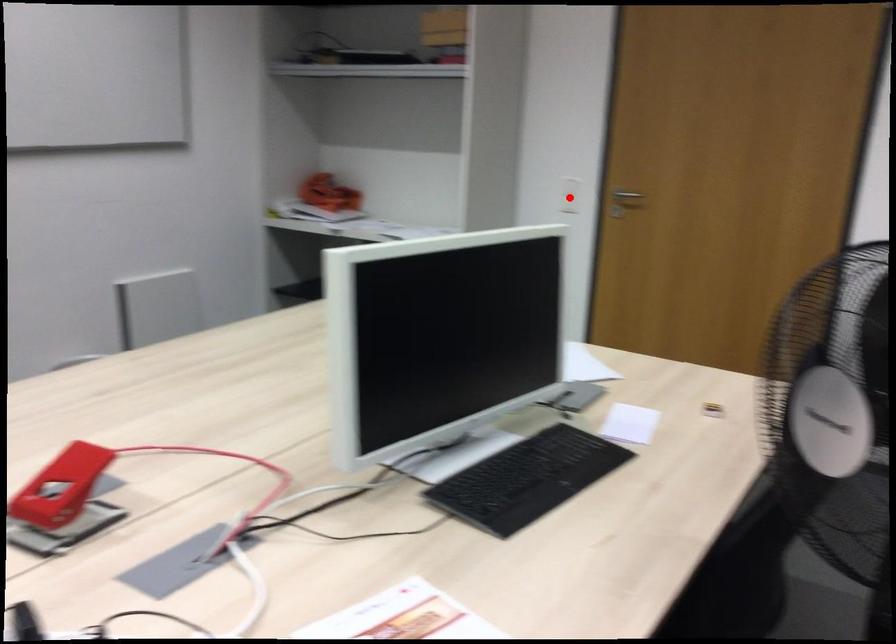
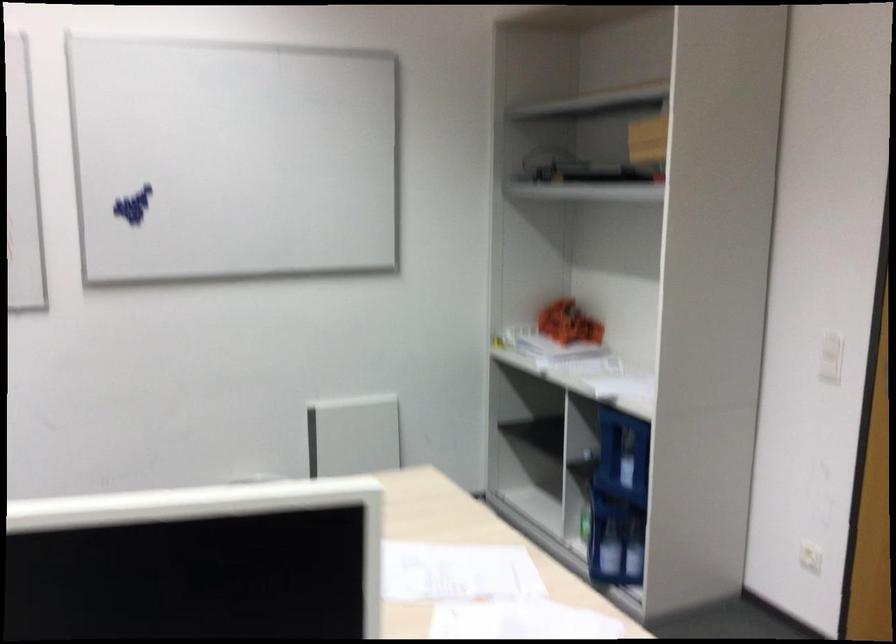
Question: I am providing you with two images of the same scene from different viewpoints. In image1, a red point is highlighted. Considering the same 3D point in image2, which of the following is correct?

Choices:
 (A) It is closer
 (B) It is farther

Answer: (A)